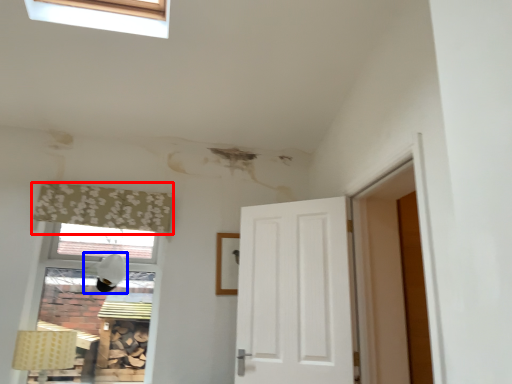
Question: Which object is further to the camera taking this photo, curtain (highlighted by a red box) or lamp (highlighted by a blue box)?

Choices:
 (A) curtain
 (B) lamp

Answer: (B)